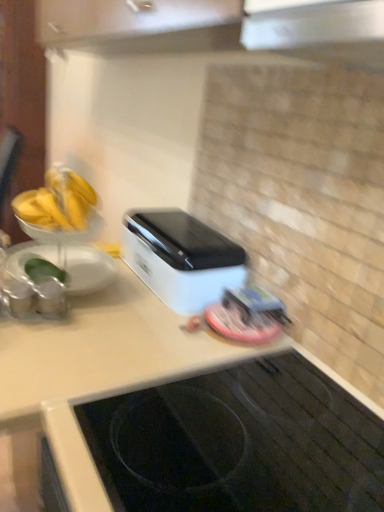
Question: In the image, is white glossy countertop at lower center on the left side or the right side of white plastic toaster at center?

Choices:
 (A) left
 (B) right

Answer: (B)

Question: From the image's perspective, is white glossy countertop at lower center above or below white plastic toaster at center?

Choices:
 (A) above
 (B) below

Answer: (B)

Question: Considering the positions of point (190, 391) and point (183, 254), is point (190, 391) closer or farther from the camera than point (183, 254)?

Choices:
 (A) closer
 (B) farther

Answer: (A)

Question: Looking at the image, does white plastic toaster at center seem bigger or smaller compared to white glossy countertop at lower center?

Choices:
 (A) big
 (B) small

Answer: (B)

Question: Is point (185, 241) positioned closer to the camera than point (102, 362)?

Choices:
 (A) closer
 (B) farther

Answer: (B)

Question: From their relative heights in the image, would you say white plastic toaster at center is taller or shorter than white glossy countertop at lower center?

Choices:
 (A) tall
 (B) short

Answer: (B)

Question: Which is correct: white plastic toaster at center is inside white glossy countertop at lower center, or outside of it?

Choices:
 (A) outside
 (B) inside

Answer: (A)